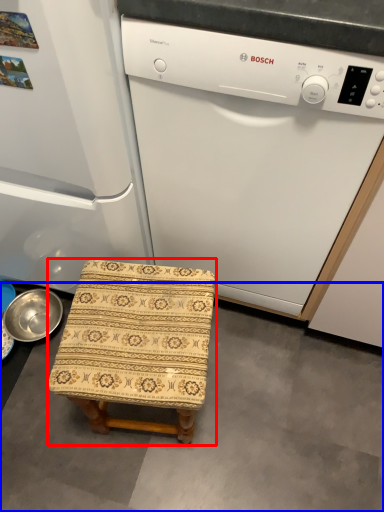
Question: Which of the following is the closest to the observer, furniture (highlighted by a red box) or concrete (highlighted by a blue box)?

Choices:
 (A) furniture
 (B) concrete

Answer: (A)